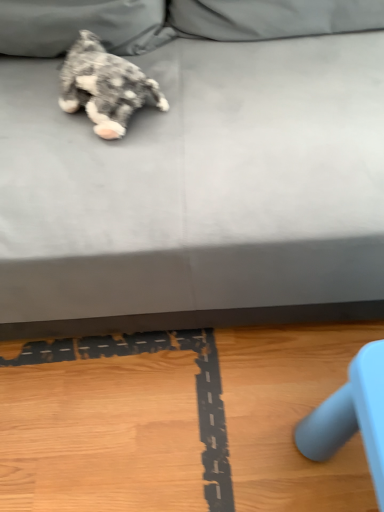
Question: Considering the relative positions of gray fabric couch at upper center and fluffy gray dog at upper left in the image provided, is gray fabric couch at upper center in front of fluffy gray dog at upper left?

Choices:
 (A) yes
 (B) no

Answer: (A)

Question: Is gray fabric couch at upper center behind fluffy gray dog at upper left?

Choices:
 (A) no
 (B) yes

Answer: (A)

Question: From a real-world perspective, is gray fabric couch at upper center positioned under fluffy gray dog at upper left based on gravity?

Choices:
 (A) no
 (B) yes

Answer: (B)

Question: Is gray fabric couch at upper center wider than fluffy gray dog at upper left?

Choices:
 (A) no
 (B) yes

Answer: (B)

Question: Is gray fabric couch at upper center facing towards fluffy gray dog at upper left?

Choices:
 (A) no
 (B) yes

Answer: (B)

Question: From a real-world perspective, does gray fabric couch at upper center stand above fluffy gray dog at upper left?

Choices:
 (A) yes
 (B) no

Answer: (B)

Question: Does fluffy gray dog at upper left come in front of gray fabric couch at upper center?

Choices:
 (A) yes
 (B) no

Answer: (B)

Question: Can you confirm if fluffy gray dog at upper left is positioned to the left of gray fabric couch at upper center?

Choices:
 (A) yes
 (B) no

Answer: (A)

Question: Is fluffy gray dog at upper left thinner than gray fabric couch at upper center?

Choices:
 (A) yes
 (B) no

Answer: (A)

Question: From the image's perspective, does fluffy gray dog at upper left appear higher than gray fabric couch at upper center?

Choices:
 (A) no
 (B) yes

Answer: (A)

Question: Is fluffy gray dog at upper left facing towards gray fabric couch at upper center?

Choices:
 (A) yes
 (B) no

Answer: (A)

Question: Can we say fluffy gray dog at upper left lies outside gray fabric couch at upper center?

Choices:
 (A) no
 (B) yes

Answer: (A)

Question: Considering the positions of point (185, 256) and point (135, 91), is point (185, 256) closer or farther from the camera than point (135, 91)?

Choices:
 (A) closer
 (B) farther

Answer: (A)